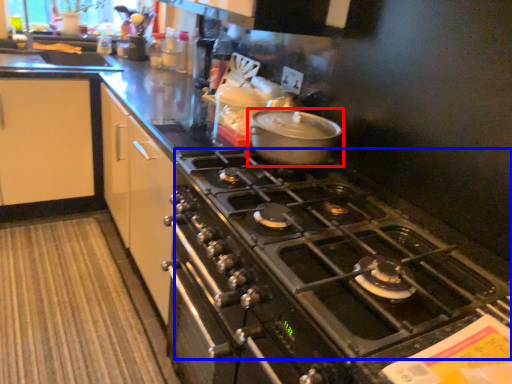
Question: Which object appears farthest to the camera in this image, kitchen appliance (highlighted by a red box) or gas stove (highlighted by a blue box)?

Choices:
 (A) kitchen appliance
 (B) gas stove

Answer: (A)